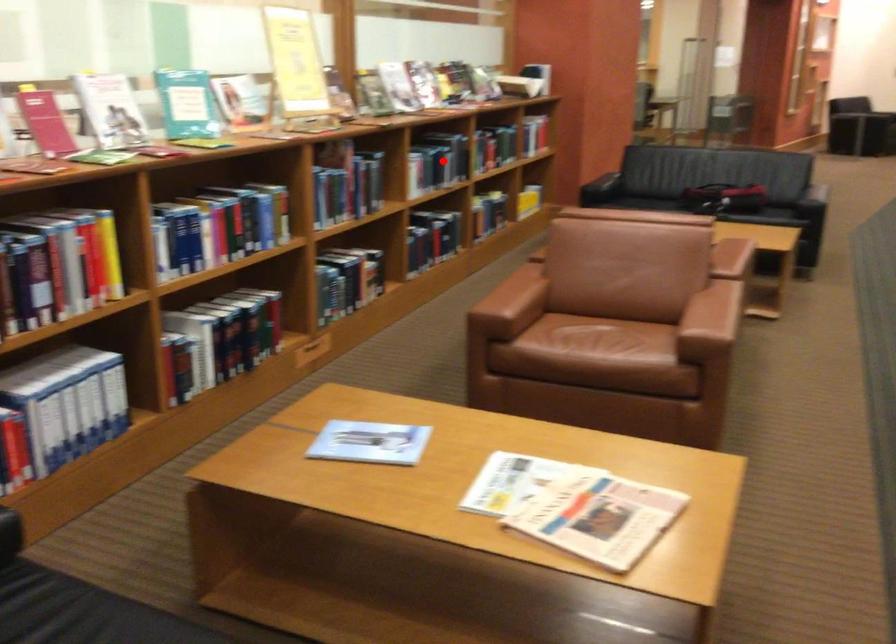
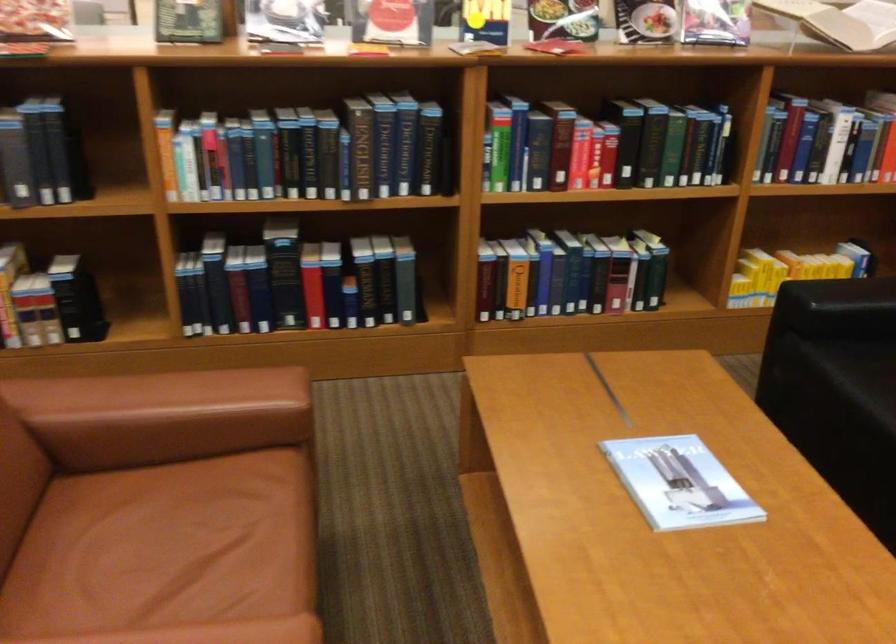
Find the pixel in the second image that matches the highlighted location in the first image.

(306, 152)